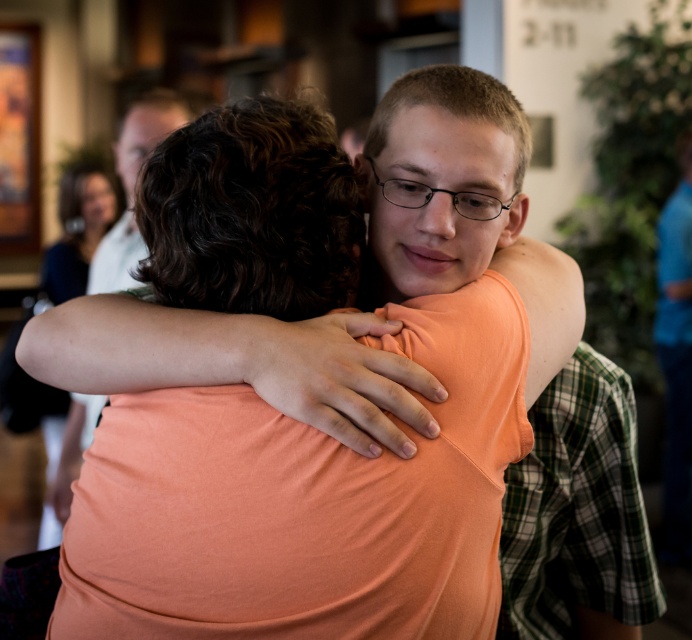
Which is in front, point (118, 324) or point (55, 524)?

Point (118, 324)

Is point (367, 452) positioned before point (53, 253)?

Yes, it is.

Where is `orange smooth arm at center`? The width and height of the screenshot is (692, 640). orange smooth arm at center is located at coordinates (237, 364).